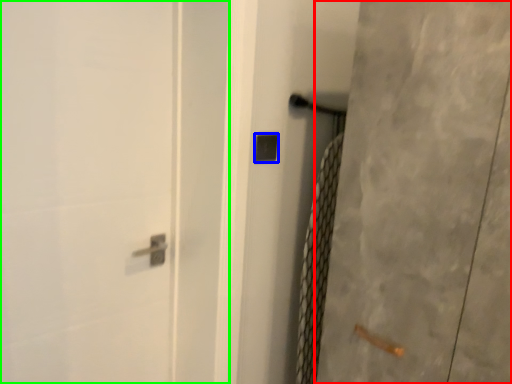
Question: Which is farther away from screen door (highlighted by a red box)? lock (highlighted by a blue box) or screen door (highlighted by a green box)?

Choices:
 (A) lock
 (B) screen door

Answer: (B)